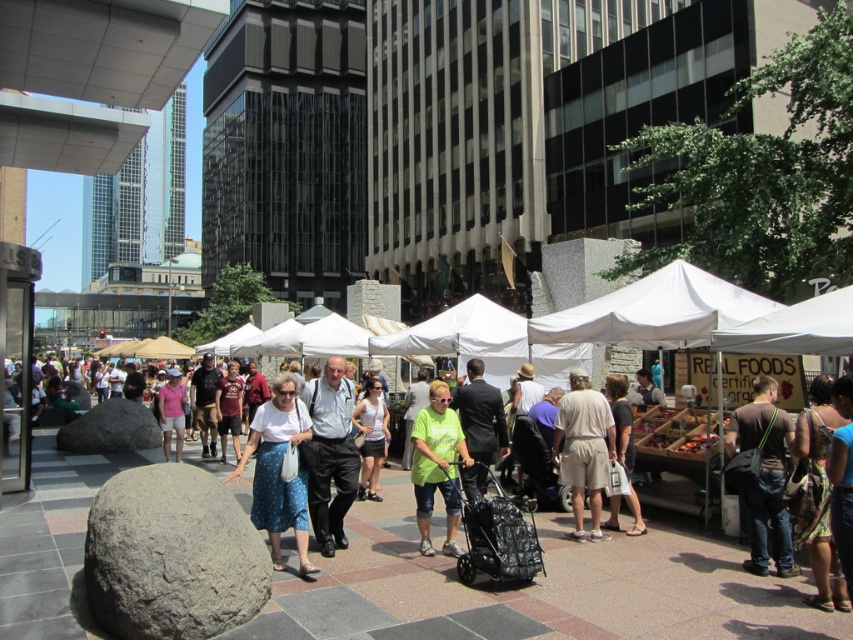
Question: From the image, what is the correct spatial relationship of green fabric shirt at center in relation to white cotton tank top at center?

Choices:
 (A) right
 (B) left

Answer: (A)

Question: Does dark brown leather backpack at lower right appear on the right side of matte pink shirt at center?

Choices:
 (A) no
 (B) yes

Answer: (B)

Question: Which point is farther to the camera?

Choices:
 (A) gray rough stone at lower left
 (B) white fabric canopy at center
 (C) dark brown leather backpack at lower right

Answer: (B)

Question: Is the position of white fabric tents at center less distant than that of tan shorts at center?

Choices:
 (A) yes
 (B) no

Answer: (A)

Question: Which object is farther from the camera taking this photo?

Choices:
 (A) gray rough stone at lower left
 (B) white fabric canopy at center
 (C) green fabric shirt at center

Answer: (C)

Question: Which point is closer to the camera?

Choices:
 (A) (270, 440)
 (B) (169, 420)
 (C) (647, 328)

Answer: (A)